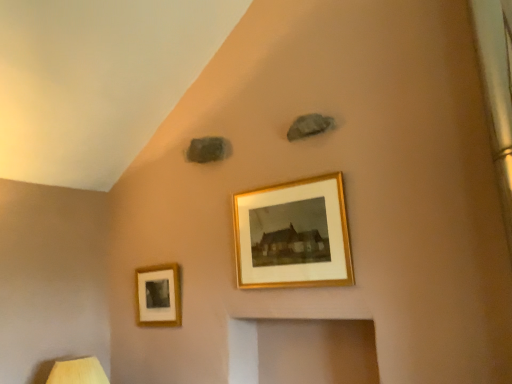
Question: Does gold-framed picture at center, which is the 1th picture frame in right-to-left order, touch matte gold picture frame at lower left, the first picture frame viewed from the left?

Choices:
 (A) no
 (B) yes

Answer: (A)

Question: Is gold-framed picture at center, the 2th picture frame viewed from the left, looking in the opposite direction of matte gold picture frame at lower left, the first picture frame viewed from the left?

Choices:
 (A) no
 (B) yes

Answer: (A)

Question: Does gold-framed picture at center, the 2th picture frame positioned from the back, have a lesser height compared to matte gold picture frame at lower left, the first picture frame positioned from the back?

Choices:
 (A) no
 (B) yes

Answer: (A)

Question: Is gold-framed picture at center, which is the 1th picture frame in right-to-left order, completely or partially outside of matte gold picture frame at lower left, positioned as the second picture frame in right-to-left order?

Choices:
 (A) no
 (B) yes

Answer: (B)

Question: Is the depth of gold-framed picture at center, the 2th picture frame viewed from the left, greater than that of matte gold picture frame at lower left, the first picture frame positioned from the back?

Choices:
 (A) no
 (B) yes

Answer: (A)

Question: Is there a large distance between gold-framed picture at center, positioned as the 2th picture frame in bottom-to-top order, and matte gold picture frame at lower left, positioned as the second picture frame in right-to-left order?

Choices:
 (A) yes
 (B) no

Answer: (B)

Question: From a real-world perspective, is wooden table lamp at lower left located beneath matte gold picture frame at lower left, the second picture frame from the top?

Choices:
 (A) no
 (B) yes

Answer: (B)

Question: Considering the relative sizes of wooden table lamp at lower left and matte gold picture frame at lower left, the first picture frame positioned from the back, in the image provided, is wooden table lamp at lower left shorter than matte gold picture frame at lower left, the first picture frame positioned from the back,?

Choices:
 (A) yes
 (B) no

Answer: (A)

Question: Is wooden table lamp at lower left not near matte gold picture frame at lower left, the 2th picture frame when ordered from front to back?

Choices:
 (A) yes
 (B) no

Answer: (B)

Question: Is wooden table lamp at lower left closer to camera compared to matte gold picture frame at lower left, the 2th picture frame when ordered from front to back?

Choices:
 (A) no
 (B) yes

Answer: (B)

Question: Can you confirm if wooden table lamp at lower left is thinner than matte gold picture frame at lower left, the first picture frame positioned from the back?

Choices:
 (A) no
 (B) yes

Answer: (A)

Question: Can you confirm if wooden table lamp at lower left is wider than matte gold picture frame at lower left, the first picture frame viewed from the left?

Choices:
 (A) no
 (B) yes

Answer: (B)

Question: Considering the relative sizes of wooden table lamp at lower left and gold-framed picture at center, which is the 1th picture frame in right-to-left order, in the image provided, is wooden table lamp at lower left shorter than gold-framed picture at center, which is the 1th picture frame in right-to-left order,?

Choices:
 (A) yes
 (B) no

Answer: (A)